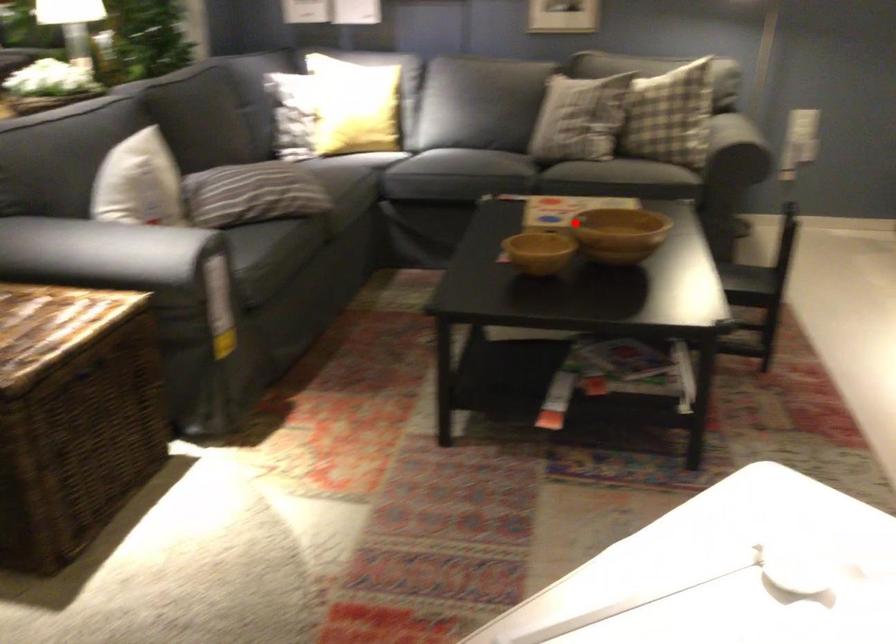
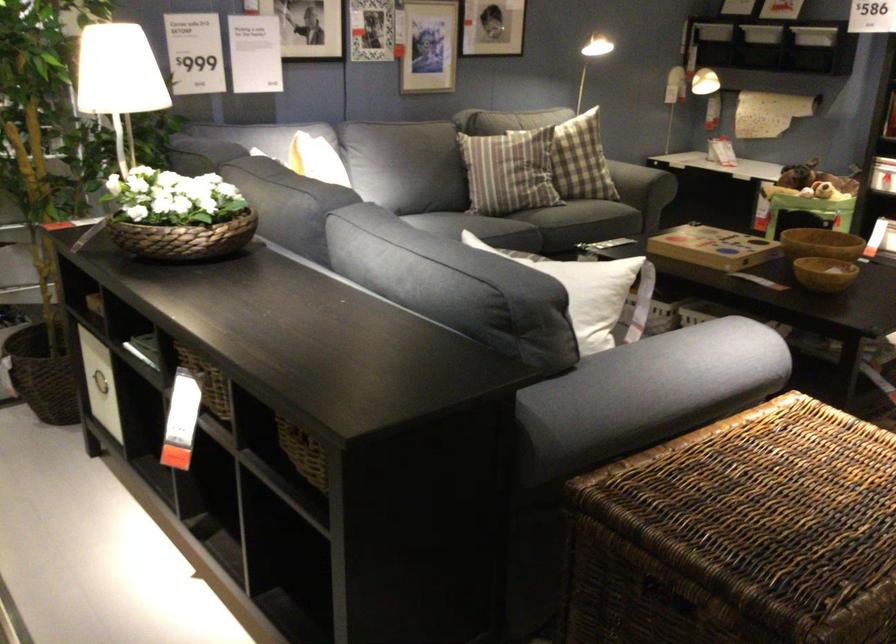
Question: I am providing you with two images of the same scene from different viewpoints. A red point is shown in image1. For the corresponding object point in image2, is it positioned nearer or farther from the camera?

Choices:
 (A) Nearer
 (B) Farther

Answer: (B)